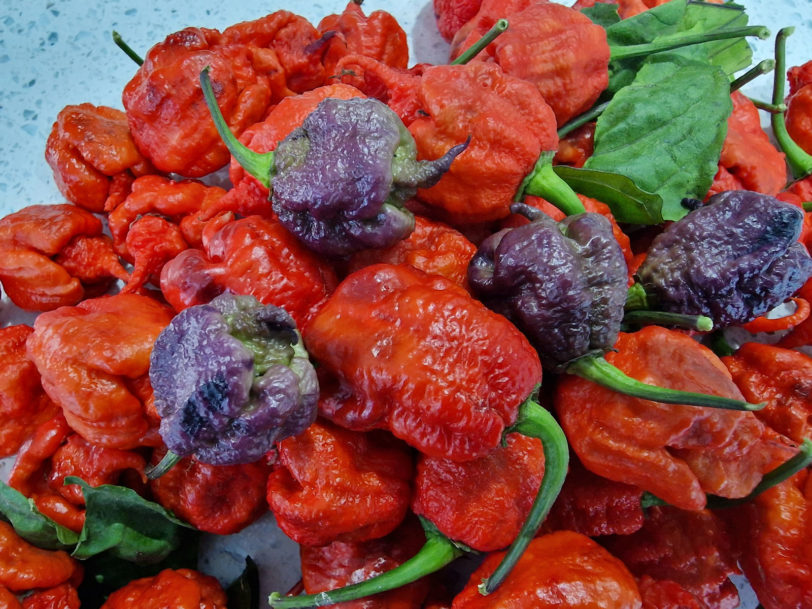
I want to click on dark blue speck in countertop, so [52, 33].